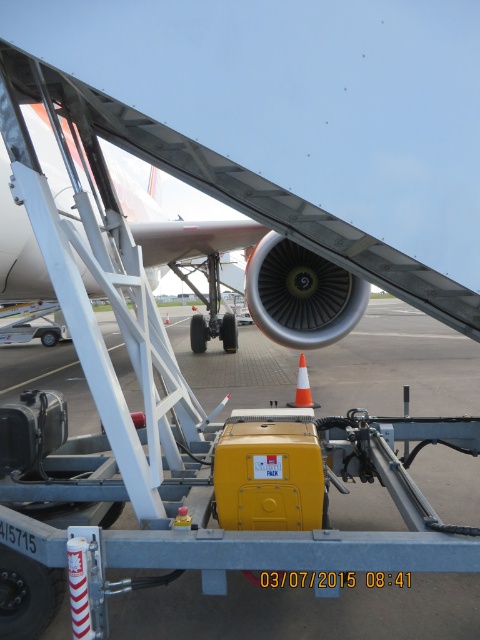
You are a maintenance worker at the airport and need to place an orange matte traffic cone at center and an orange cone at center on the tarmac. However, you have a storage container that can only hold the smaller of the two cones. Which cone should you put into the container?

The orange matte traffic cone at center is smaller than orange cone at center, so you should place the orange matte traffic cone at center into the container.

You are a maintenance worker standing on the tarmac. You need to check the height of the metallic silver airplane at center and the orange matte traffic cone at center. Which object is taller?

The metallic silver airplane at center is taller than the orange matte traffic cone at center.

You are a ground crew member and you see the metallic silver airplane at center and the orange cone at center. Which object is closer to you?

The orange cone at center is closer to you because the metallic silver airplane at center is positioned over it, meaning the cone is underneath the airplane and thus closer to your viewpoint.